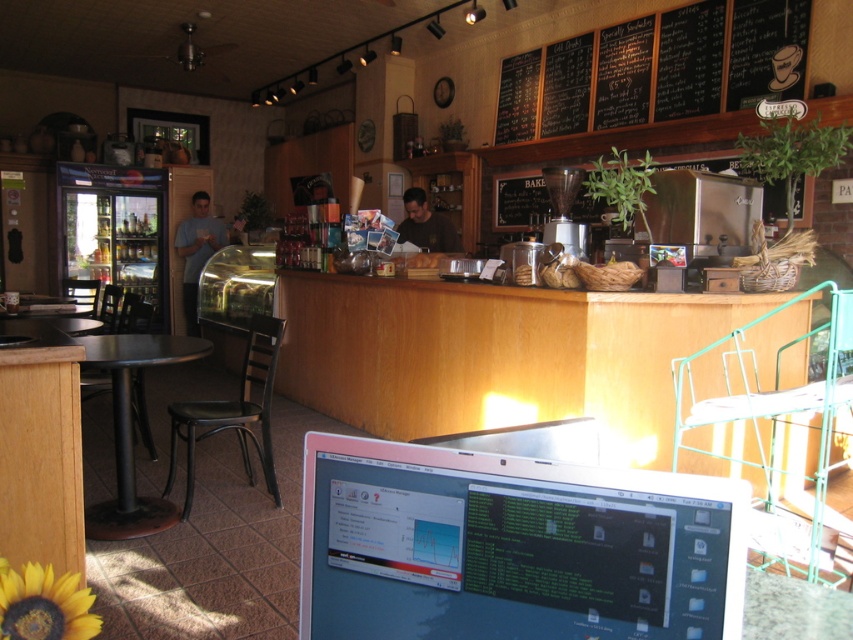
Identify the location of black chalkboard menu at upper center. The image size is (853, 640). (656, 68).

Which is in front, point (525, 97) or point (119, 340)?

Point (119, 340) is in front.

Is point (722, 49) less distant than point (166, 502)?

No, (722, 49) is further to viewer.

Where is `black chalkboard menu at upper center`? black chalkboard menu at upper center is located at coordinates (656, 68).

Which is below, satin silver laptop at lower center or black chalkboard menu at upper center?

satin silver laptop at lower center is below.

Who is positioned more to the left, satin silver laptop at lower center or black chalkboard menu at upper center?

Positioned to the left is satin silver laptop at lower center.

Who is more forward, (326, 472) or (666, 24)?

Point (326, 472) is in front.

The image size is (853, 640). I want to click on satin silver laptop at lower center, so click(512, 547).

This screenshot has width=853, height=640. What are the coordinates of `satin silver laptop at lower center` in the screenshot? It's located at (512, 547).

Who is positioned more to the right, satin silver laptop at lower center or black metal table at left?

satin silver laptop at lower center

Does point (413, 636) come closer to viewer compared to point (126, 502)?

Yes, point (413, 636) is closer to viewer.

In order to click on satin silver laptop at lower center in this screenshot , I will do `click(512, 547)`.